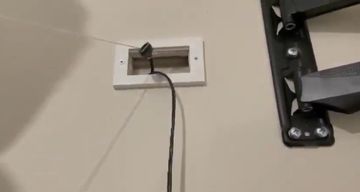
This screenshot has width=360, height=192. Find the location of `wall`. wall is located at coordinates (x=245, y=108).